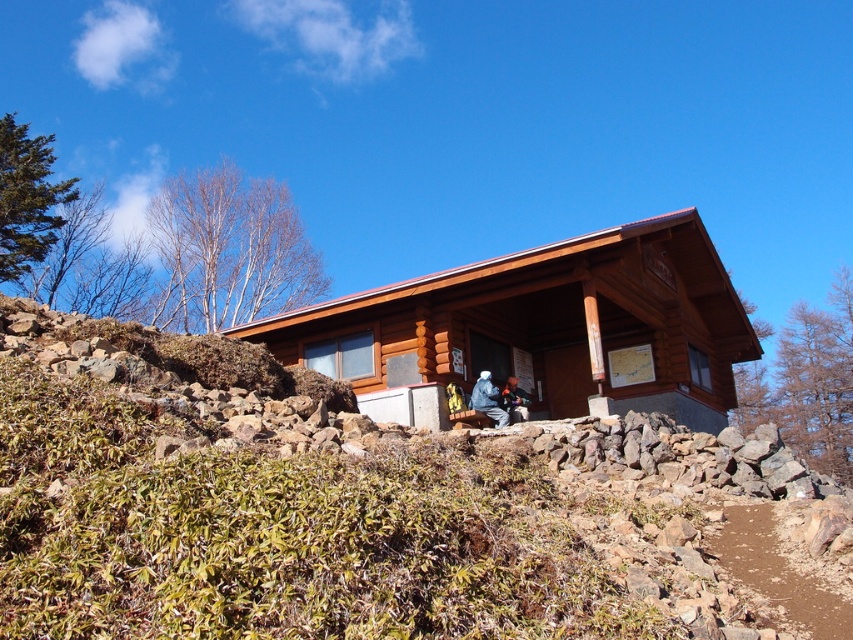
Measure the distance between point (x=656, y=381) and camera.

Point (x=656, y=381) and camera are 17.80 meters apart.

Can you confirm if brown wooden cabin at center is positioned to the right of blue fuzzy jacket at center?

Correct, you'll find brown wooden cabin at center to the right of blue fuzzy jacket at center.

Between point (741, 328) and point (500, 419), which one is positioned behind?

Point (741, 328)

Image resolution: width=853 pixels, height=640 pixels. In order to click on brown wooden cabin at center in this screenshot , I will do `click(547, 324)`.

What do you see at coordinates (351, 506) in the screenshot? I see `brown wooden log cabin at center` at bounding box center [351, 506].

Which of these two, brown wooden log cabin at center or dark blue jacket at lower center, stands shorter?

With less height is dark blue jacket at lower center.

Who is more distant from viewer, (560, 541) or (515, 380)?

The point (515, 380) is behind.

Where is `brown wooden log cabin at center`? The width and height of the screenshot is (853, 640). brown wooden log cabin at center is located at coordinates (351, 506).

Does point (477, 392) come behind point (506, 385)?

No, (477, 392) is closer to viewer.

In the scene shown: Is blue fuzzy jacket at center positioned before dark blue jacket at lower center?

Yes.

Which is in front, point (495, 401) or point (503, 400)?

Point (495, 401) is in front.

Where is `blue fuzzy jacket at center`? Image resolution: width=853 pixels, height=640 pixels. blue fuzzy jacket at center is located at coordinates (488, 400).